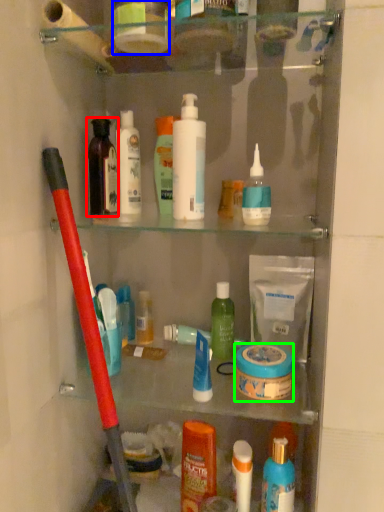
Question: Which is nearer to the toiletry (highlighted by a red box)? toiletry (highlighted by a blue box) or mouthwash (highlighted by a green box).

Choices:
 (A) toiletry
 (B) mouthwash

Answer: (A)